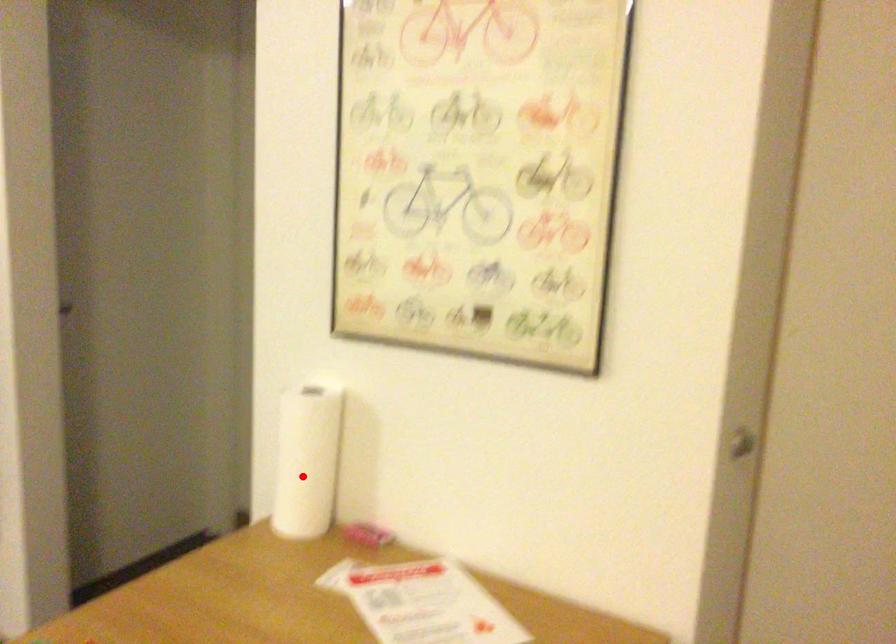
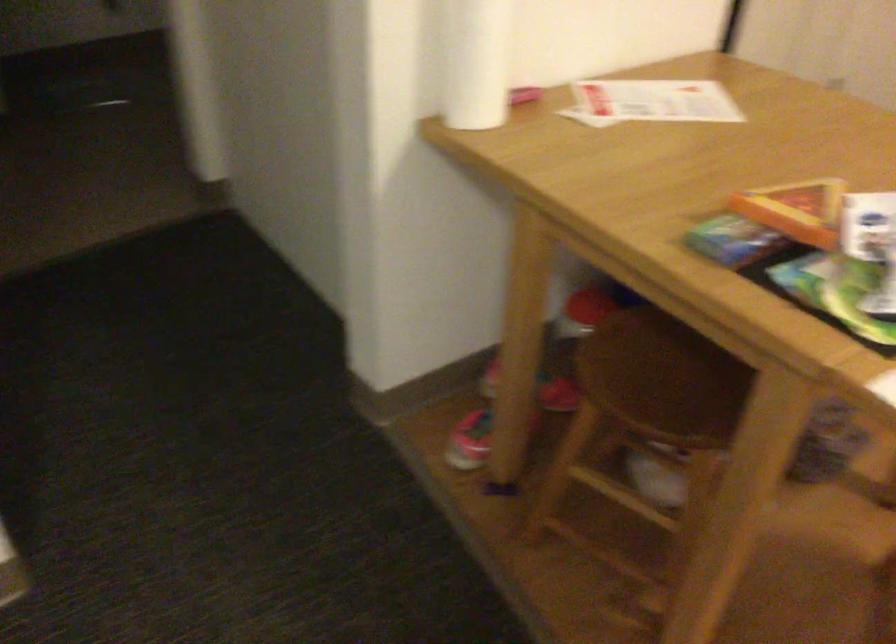
Find the pixel in the second image that matches the highlighted location in the first image.

(476, 62)